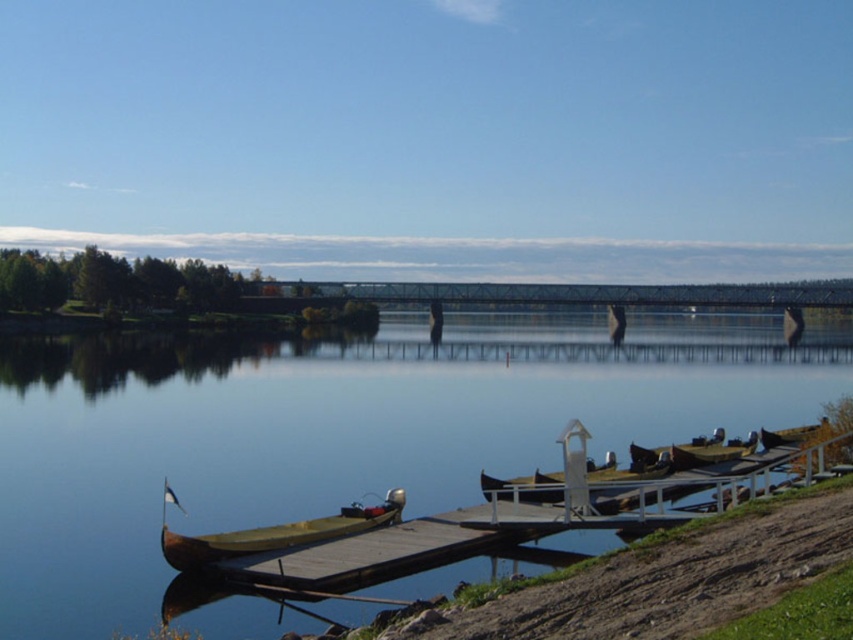
You are standing on the wooden dock and looking towards the smooth blue water at center and the brown dirt at lower right. Which one appears taller from your perspective?

The smooth blue water at center appears taller than the brown dirt at lower right because it has a greater height compared to it.